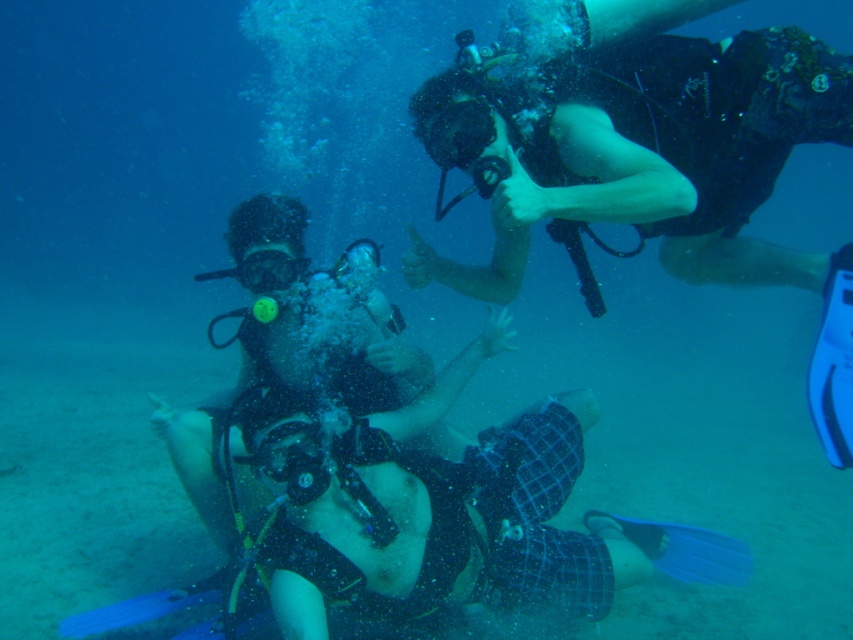
Question: Does black matte scuba gear at upper center appear over matte black goggles at center?

Choices:
 (A) no
 (B) yes

Answer: (B)

Question: Considering the relative positions of black matte scuba gear at upper center and matte black goggles at center in the image provided, where is black matte scuba gear at upper center located with respect to matte black goggles at center?

Choices:
 (A) above
 (B) below

Answer: (A)

Question: Which object is closer to the camera taking this photo?

Choices:
 (A) black matte scuba gear at upper center
 (B) matte black goggles at center

Answer: (A)

Question: In this image, where is black matte scuba gear at upper center located relative to matte black goggles at center?

Choices:
 (A) left
 (B) right

Answer: (B)